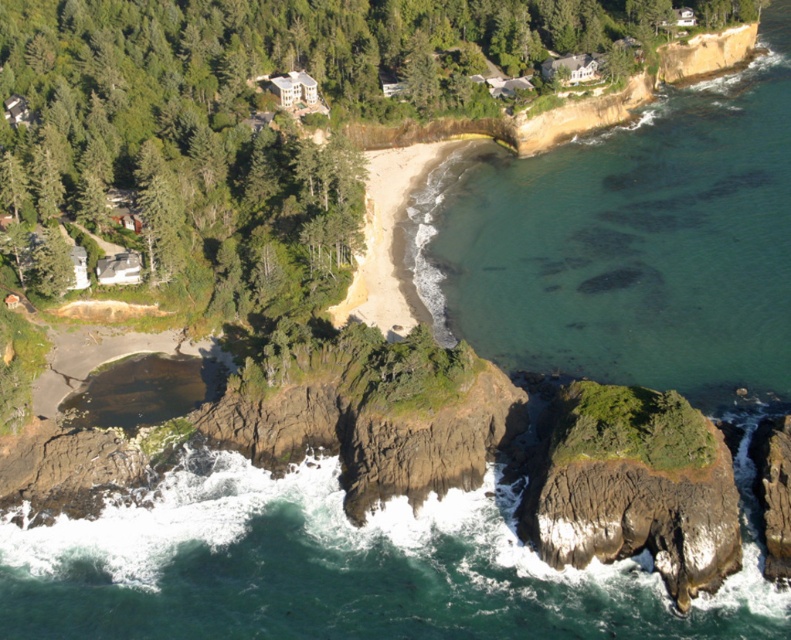
Question: Which of the following is the farthest from the observer?

Choices:
 (A) (555, 404)
 (B) (528, 256)

Answer: (B)

Question: Considering the relative positions of clear water at upper right and rugged brown rock at lower right in the image provided, where is clear water at upper right located with respect to rugged brown rock at lower right?

Choices:
 (A) right
 (B) left

Answer: (A)

Question: Considering the relative positions of clear water at upper right and rugged brown rock at lower right in the image provided, where is clear water at upper right located with respect to rugged brown rock at lower right?

Choices:
 (A) left
 (B) right

Answer: (B)

Question: Can you confirm if clear water at upper right is positioned below rugged brown rock at lower right?

Choices:
 (A) no
 (B) yes

Answer: (A)